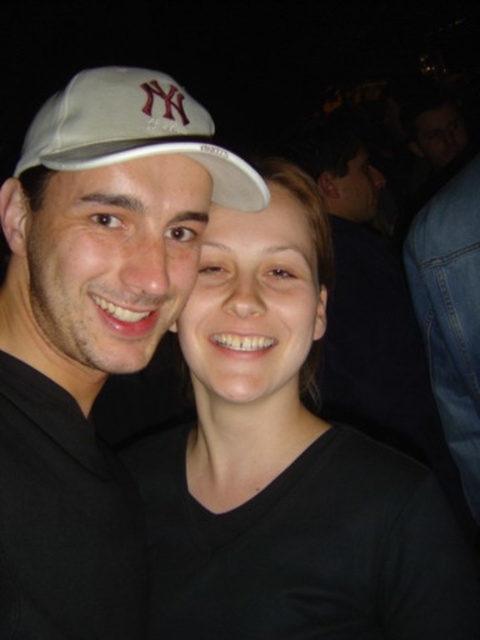
Question: Is white matte cap at left smaller than white matte baseball cap at upper left?

Choices:
 (A) yes
 (B) no

Answer: (B)

Question: Based on their relative distances, which object is nearer to the white matte cap at left?

Choices:
 (A) black matte shirt at center
 (B) white matte baseball cap at upper left

Answer: (B)

Question: Is black matte shirt at center behind white matte cap at left?

Choices:
 (A) no
 (B) yes

Answer: (B)

Question: Which object is positioned farthest from the black matte shirt at center?

Choices:
 (A) white matte baseball cap at upper left
 (B) white matte cap at left

Answer: (A)

Question: Considering the relative positions of white matte cap at left and white matte baseball cap at upper left in the image provided, where is white matte cap at left located with respect to white matte baseball cap at upper left?

Choices:
 (A) left
 (B) right

Answer: (A)

Question: Which point is farther to the camera?

Choices:
 (A) (108, 480)
 (B) (127, 113)

Answer: (A)